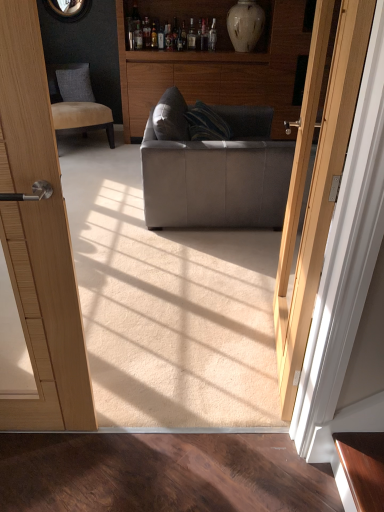
Question: Is wooden cabinet at center smaller than white glossy vase at upper center?

Choices:
 (A) yes
 (B) no

Answer: (B)

Question: Would you say wooden cabinet at center contains white glossy vase at upper center?

Choices:
 (A) no
 (B) yes

Answer: (B)

Question: Is wooden cabinet at center bigger than white glossy vase at upper center?

Choices:
 (A) yes
 (B) no

Answer: (A)

Question: Is wooden cabinet at center to the left of white glossy vase at upper center from the viewer's perspective?

Choices:
 (A) no
 (B) yes

Answer: (B)

Question: Does wooden cabinet at center have a lesser width compared to white glossy vase at upper center?

Choices:
 (A) yes
 (B) no

Answer: (B)

Question: Is point (251, 10) positioned closer to the camera than point (112, 138)?

Choices:
 (A) closer
 (B) farther

Answer: (A)

Question: Is white glossy vase at upper center wider or thinner than beige fabric chair at upper left?

Choices:
 (A) thin
 (B) wide

Answer: (A)

Question: Is white glossy vase at upper center situated inside beige fabric chair at upper left or outside?

Choices:
 (A) inside
 (B) outside

Answer: (B)

Question: In terms of height, does white glossy vase at upper center look taller or shorter compared to beige fabric chair at upper left?

Choices:
 (A) short
 (B) tall

Answer: (A)

Question: Considering the positions of dark gray fabric pillow at upper left and wooden cabinet at center in the image, is dark gray fabric pillow at upper left wider or thinner than wooden cabinet at center?

Choices:
 (A) wide
 (B) thin

Answer: (B)

Question: Is point (62, 74) closer or farther from the camera than point (125, 106)?

Choices:
 (A) farther
 (B) closer

Answer: (A)

Question: Considering the positions of dark gray fabric pillow at upper left and wooden cabinet at center in the image, is dark gray fabric pillow at upper left taller or shorter than wooden cabinet at center?

Choices:
 (A) tall
 (B) short

Answer: (B)

Question: From a real-world perspective, is dark gray fabric pillow at upper left physically located above or below wooden cabinet at center?

Choices:
 (A) above
 (B) below

Answer: (B)

Question: Is point (233, 186) closer or farther from the camera than point (77, 74)?

Choices:
 (A) closer
 (B) farther

Answer: (A)

Question: From the image's perspective, is matte gray fabric couch at center positioned above or below beige fabric chair at upper left?

Choices:
 (A) above
 (B) below

Answer: (B)